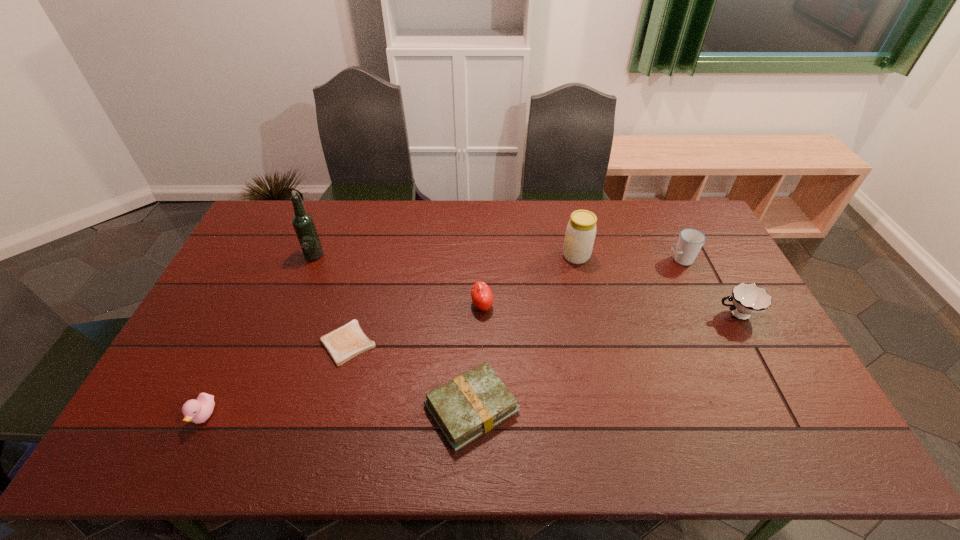
I want to click on empty space that is in between the seventh tallest object and the shorter cup, so click(x=604, y=361).

Image resolution: width=960 pixels, height=540 pixels. What are the coordinates of `vacant space in between the duckling and the second shortest object` in the screenshot? It's located at (338, 411).

This screenshot has height=540, width=960. In order to click on the seventh closest object relative to the taller cup in this screenshot , I will do `click(197, 411)`.

At what (x,y) coordinates should I click in order to perform the action: click on object that is the second closest to the shorter cup. Please return your answer as a coordinate pair (x, y). This screenshot has width=960, height=540. Looking at the image, I should click on (580, 234).

I want to click on vacant region that satisfies the following two spatial constraints: 1. with a handle on the side of the taller cup; 2. on the front-facing side of the duckling, so click(x=755, y=415).

Locate an element on the screen. This screenshot has width=960, height=540. vacant region that satisfies the following two spatial constraints: 1. with a handle on the side of the taller cup; 2. on the front side of the toast is located at coordinates (720, 343).

Locate an element on the screen. Image resolution: width=960 pixels, height=540 pixels. vacant position in the image that satisfies the following two spatial constraints: 1. on the back side of the jar; 2. on the left side of the third object from left to right is located at coordinates (371, 256).

The image size is (960, 540). I want to click on free spot that satisfies the following two spatial constraints: 1. on the side of the nearer cup with the handle; 2. with a handle on the side of the farther cup, so click(x=707, y=260).